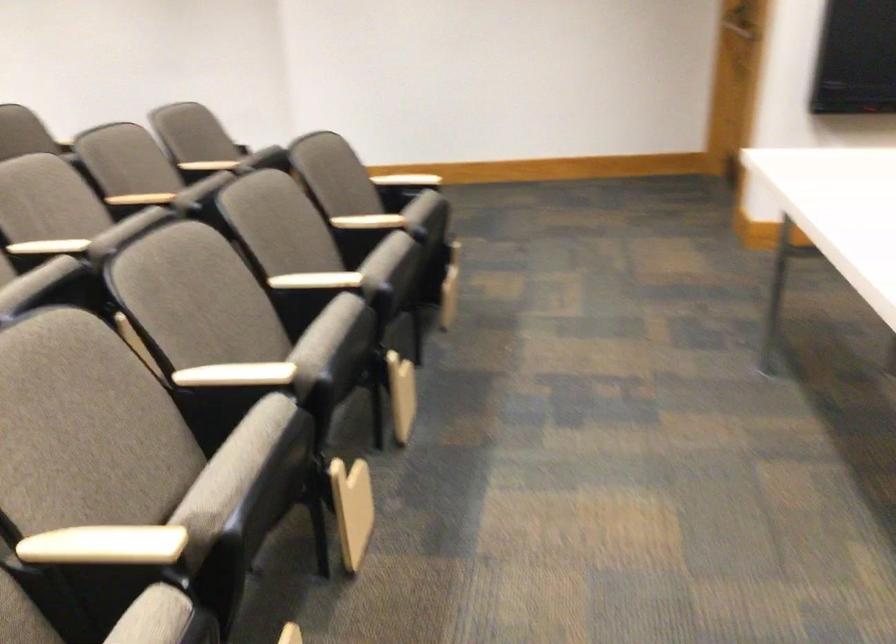
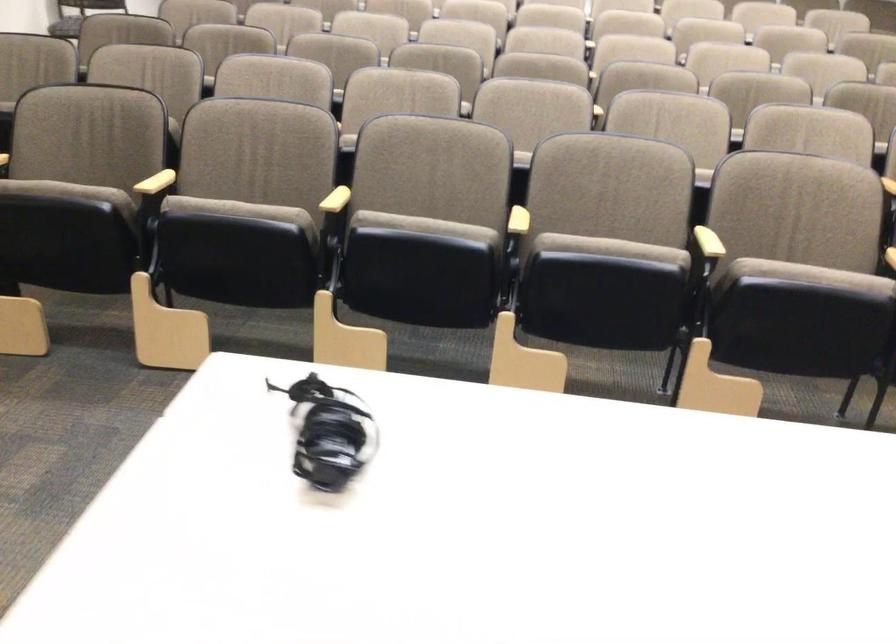
Find the pixel in the second image that matches pixel 231 451 in the first image.

(424, 225)